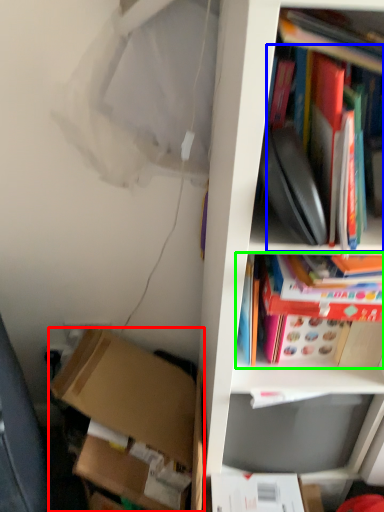
Question: Considering the real-world distances, which object is farthest from box (highlighted by a red box)? book (highlighted by a blue box) or book (highlighted by a green box)?

Choices:
 (A) book
 (B) book

Answer: (A)